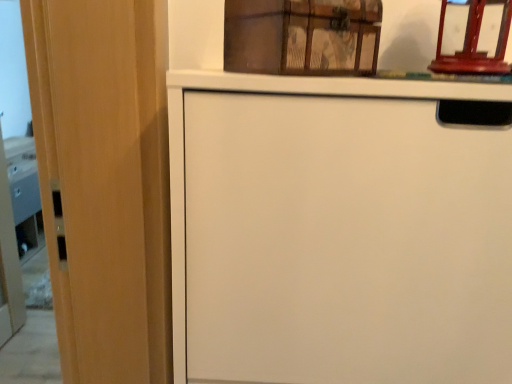
Question: Which direction should I rotate to look at wooden trunk at upper center, placed as the first cabinetry when sorted from top to bottom?

Choices:
 (A) right
 (B) left

Answer: (A)

Question: Does white matte cabinet at center, the second cabinetry in the top-to-bottom sequence, turn towards wooden trunk at upper center, placed as the first cabinetry when sorted from top to bottom?

Choices:
 (A) no
 (B) yes

Answer: (A)

Question: Is white matte cabinet at center, the second cabinetry in the top-to-bottom sequence, wider than wooden trunk at upper center, placed as the first cabinetry when sorted from top to bottom?

Choices:
 (A) yes
 (B) no

Answer: (A)

Question: Considering the relative sizes of white matte cabinet at center, the first cabinetry when ordered from bottom to top, and wooden trunk at upper center, placed as the first cabinetry when sorted from top to bottom, in the image provided, is white matte cabinet at center, the first cabinetry when ordered from bottom to top, smaller than wooden trunk at upper center, placed as the first cabinetry when sorted from top to bottom,?

Choices:
 (A) yes
 (B) no

Answer: (B)

Question: Is white matte cabinet at center, the second cabinetry in the top-to-bottom sequence, to the left of wooden trunk at upper center, which is counted as the second cabinetry, starting from the bottom, from the viewer's perspective?

Choices:
 (A) no
 (B) yes

Answer: (A)

Question: From a real-world perspective, is white matte cabinet at center, the second cabinetry in the top-to-bottom sequence, located beneath wooden trunk at upper center, which is counted as the second cabinetry, starting from the bottom?

Choices:
 (A) no
 (B) yes

Answer: (B)

Question: Is white matte cabinet at center, the first cabinetry when ordered from bottom to top, thinner than wooden trunk at upper center, which is counted as the second cabinetry, starting from the bottom?

Choices:
 (A) no
 (B) yes

Answer: (A)

Question: Can we say wooden trunk at upper center, placed as the first cabinetry when sorted from top to bottom, lies outside white matte cabinet at center, the first cabinetry when ordered from bottom to top?

Choices:
 (A) no
 (B) yes

Answer: (B)

Question: From a real-world perspective, is wooden trunk at upper center, placed as the first cabinetry when sorted from top to bottom, under white matte cabinet at center, the second cabinetry in the top-to-bottom sequence?

Choices:
 (A) yes
 (B) no

Answer: (B)

Question: Considering the relative sizes of wooden trunk at upper center, placed as the first cabinetry when sorted from top to bottom, and white matte cabinet at center, the first cabinetry when ordered from bottom to top, in the image provided, is wooden trunk at upper center, placed as the first cabinetry when sorted from top to bottom, thinner than white matte cabinet at center, the first cabinetry when ordered from bottom to top,?

Choices:
 (A) no
 (B) yes

Answer: (B)

Question: Are wooden trunk at upper center, which is counted as the second cabinetry, starting from the bottom, and white matte cabinet at center, the first cabinetry when ordered from bottom to top, far apart?

Choices:
 (A) yes
 (B) no

Answer: (B)

Question: From the image's perspective, would you say wooden trunk at upper center, placed as the first cabinetry when sorted from top to bottom, is positioned over white matte cabinet at center, the second cabinetry in the top-to-bottom sequence?

Choices:
 (A) yes
 (B) no

Answer: (A)

Question: Is wooden trunk at upper center, which is counted as the second cabinetry, starting from the bottom, oriented away from white matte cabinet at center, the first cabinetry when ordered from bottom to top?

Choices:
 (A) yes
 (B) no

Answer: (B)

Question: From their relative heights in the image, would you say wooden trunk at upper center, placed as the first cabinetry when sorted from top to bottom, is taller or shorter than white matte cabinet at center, the first cabinetry when ordered from bottom to top?

Choices:
 (A) tall
 (B) short

Answer: (B)